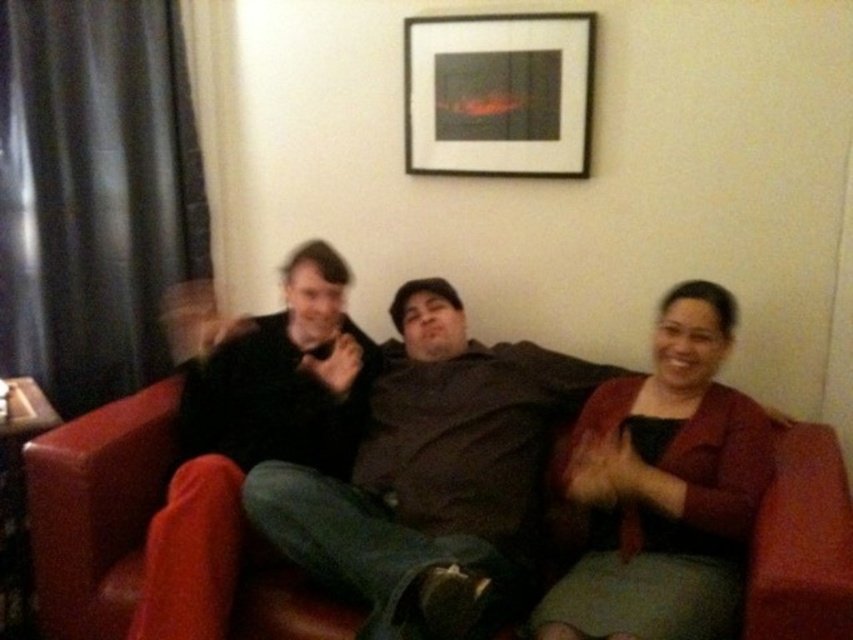
You are trying to decide which item to take with you from the scene. You can only choose between the dark brown sweater at center and the matte black jacket at center. Based on their sizes, which one would you choose if you want the larger one?

The matte black jacket at center is larger than the dark brown sweater at center, so you should choose the matte black jacket at center if you want the larger one.

You are standing in front of the couch where the three people are sitting. There is a point at coordinates point (190, 381) that you need to reach. Can you estimate whether you can comfortably reach that point without moving the couch or the people?

The distance between point (190, 381) and the viewer is 2.12 meters. Since the point is 2.12 meters away, it may be difficult to reach comfortably without moving the couch or the people, as this distance requires stretching or taking a few steps forward.

You are an interior designer assessing the living room layout. You notice the matte black jacket at center and the black matte picture frame at upper center. Which object occupies more horizontal space in the scene?

The matte black jacket at center occupies more horizontal space than the black matte picture frame at upper center because its width is larger.